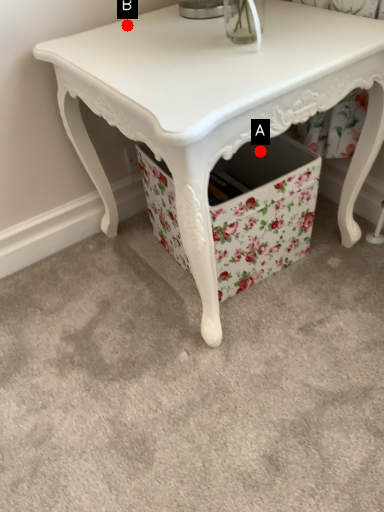
Question: Two points are circled on the image, labeled by A and B beside each circle. Which point is farther to the camera?

Choices:
 (A) A is further
 (B) B is further

Answer: (A)